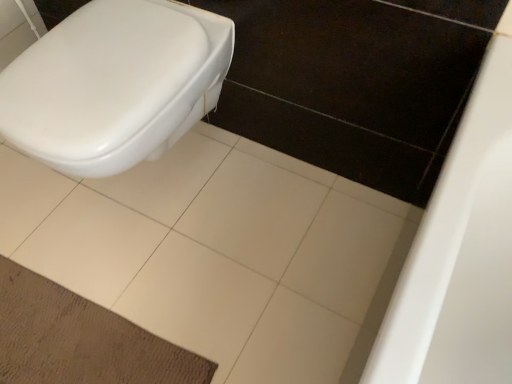
Question: Does brown textured mat at lower left have a larger size compared to white ceramic tile at center?

Choices:
 (A) no
 (B) yes

Answer: (A)

Question: Does brown textured mat at lower left contain white ceramic tile at center?

Choices:
 (A) no
 (B) yes

Answer: (A)

Question: Is brown textured mat at lower left wider than white ceramic tile at center?

Choices:
 (A) no
 (B) yes

Answer: (A)

Question: Is brown textured mat at lower left positioned far away from white ceramic tile at center?

Choices:
 (A) yes
 (B) no

Answer: (B)

Question: Is the depth of brown textured mat at lower left less than that of white ceramic tile at center?

Choices:
 (A) no
 (B) yes

Answer: (A)

Question: Is point (262, 152) closer or farther from the camera than point (195, 44)?

Choices:
 (A) closer
 (B) farther

Answer: (B)

Question: Would you say white ceramic tile at center is inside or outside white glossy toilet at left?

Choices:
 (A) inside
 (B) outside

Answer: (B)

Question: From the image's perspective, is white ceramic tile at center located above or below white glossy toilet at left?

Choices:
 (A) above
 (B) below

Answer: (B)

Question: Based on their sizes in the image, would you say white ceramic tile at center is bigger or smaller than white glossy toilet at left?

Choices:
 (A) big
 (B) small

Answer: (B)

Question: Considering the positions of brown textured mat at lower left and white ceramic tile at center in the image, is brown textured mat at lower left bigger or smaller than white ceramic tile at center?

Choices:
 (A) big
 (B) small

Answer: (B)

Question: In terms of width, does brown textured mat at lower left look wider or thinner when compared to white ceramic tile at center?

Choices:
 (A) thin
 (B) wide

Answer: (A)

Question: Do you think brown textured mat at lower left is within white ceramic tile at center, or outside of it?

Choices:
 (A) outside
 (B) inside

Answer: (B)

Question: Considering the positions of point (53, 301) and point (306, 266), is point (53, 301) closer or farther from the camera than point (306, 266)?

Choices:
 (A) closer
 (B) farther

Answer: (A)

Question: Considering the relative positions of white ceramic tile at center and brown textured mat at lower left in the image provided, is white ceramic tile at center to the left or to the right of brown textured mat at lower left?

Choices:
 (A) right
 (B) left

Answer: (A)

Question: Looking at the image, does white ceramic tile at center seem bigger or smaller compared to brown textured mat at lower left?

Choices:
 (A) small
 (B) big

Answer: (B)